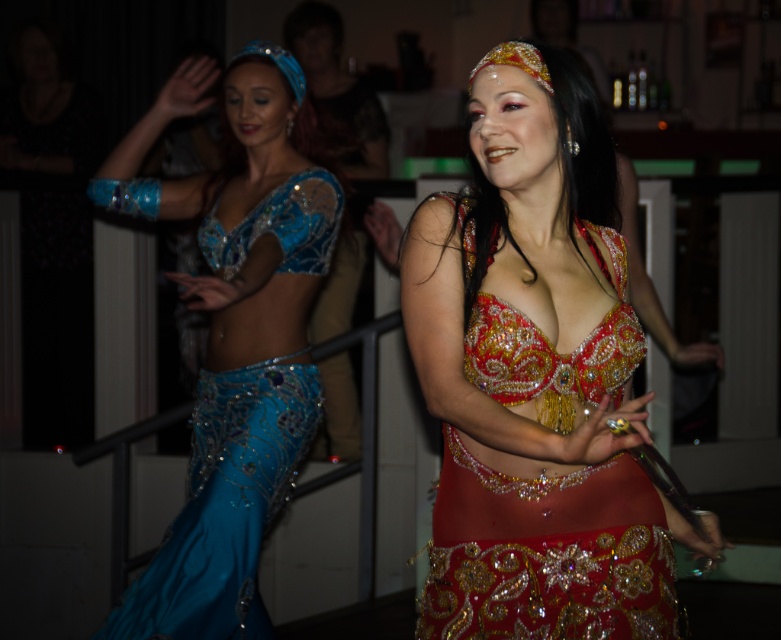
Consider the image. You are a photographer setting up in the venue to capture the belly dancers. You need to focus your camera on the two points in the image. Which point, point (594,298) or point (307,144), is closer to your camera lens?

Point (594,298) is closer to the camera lens than point (307,144).

You are a photographer in the venue and want to capture both dancers in a single shot. Since the shiny sequined costume at center is shorter than the shiny blue fabric at left, where should you position your camera to ensure both are fully visible?

To ensure both the shiny sequined costume at center and the shiny blue fabric at left are fully visible, position the camera at a lower angle so that the shorter shiny sequined costume at center and the taller shiny blue fabric at left are both in frame.